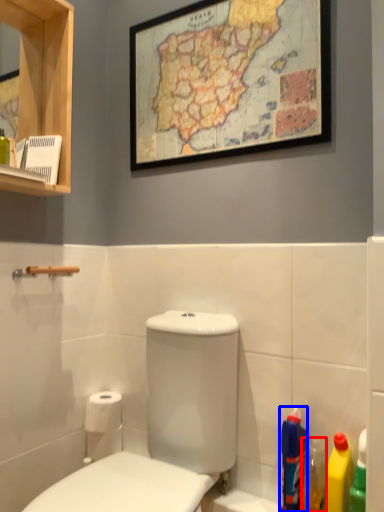
Question: Which of the following is the closest to the observer, cleaning product (highlighted by a red box) or cleaning product (highlighted by a blue box)?

Choices:
 (A) cleaning product
 (B) cleaning product

Answer: (A)